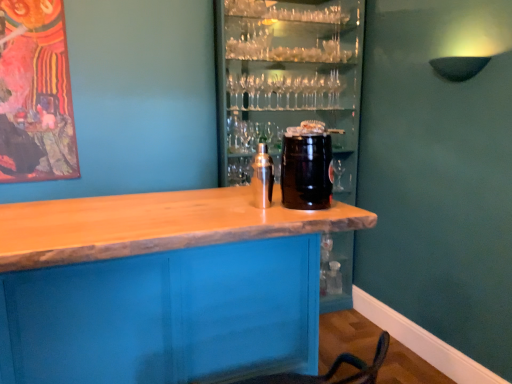
Question: Is wooden at center further to the viewer compared to satin silver shaker at center, which ranks as the 2th beverage in right-to-left order?

Choices:
 (A) no
 (B) yes

Answer: (B)

Question: Is wooden at center outside satin silver shaker at center, the first beverage in the left-to-right sequence?

Choices:
 (A) yes
 (B) no

Answer: (A)

Question: Does wooden at center have a greater height compared to satin silver shaker at center, which ranks as the 2th beverage in right-to-left order?

Choices:
 (A) yes
 (B) no

Answer: (A)

Question: Considering the relative positions of wooden at center and satin silver shaker at center, which ranks as the 2th beverage in right-to-left order, in the image provided, is wooden at center in front of satin silver shaker at center, which ranks as the 2th beverage in right-to-left order,?

Choices:
 (A) no
 (B) yes

Answer: (A)

Question: Does wooden at center have a greater width compared to satin silver shaker at center, the first beverage in the left-to-right sequence?

Choices:
 (A) no
 (B) yes

Answer: (B)

Question: Is satin silver shaker at center, which ranks as the 2th beverage in right-to-left order, taller or shorter than black matte keg at center, the first beverage from the right?

Choices:
 (A) tall
 (B) short

Answer: (B)

Question: Relative to black matte keg at center, the first beverage from the right, is satin silver shaker at center, the first beverage in the left-to-right sequence, in front or behind?

Choices:
 (A) behind
 (B) front

Answer: (A)

Question: Would you say satin silver shaker at center, the first beverage in the left-to-right sequence, is to the left or to the right of black matte keg at center, acting as the 2th beverage starting from the left, in the picture?

Choices:
 (A) right
 (B) left

Answer: (B)

Question: Is point coord(272,182) positioned closer to the camera than point coord(285,147)?

Choices:
 (A) farther
 (B) closer

Answer: (A)

Question: Considering the positions of wooden at center and black matte keg at center, the first beverage from the right, in the image, is wooden at center bigger or smaller than black matte keg at center, the first beverage from the right,?

Choices:
 (A) small
 (B) big

Answer: (B)

Question: In the image, is wooden at center positioned in front of or behind black matte keg at center, the first beverage from the right?

Choices:
 (A) behind
 (B) front

Answer: (A)

Question: From the image's perspective, is wooden at center above or below black matte keg at center, the first beverage from the right?

Choices:
 (A) above
 (B) below

Answer: (A)

Question: Is wooden at center inside the boundaries of black matte keg at center, the first beverage from the right, or outside?

Choices:
 (A) inside
 (B) outside

Answer: (B)

Question: Choose the correct answer: Is wooden table at center inside satin silver shaker at center, which ranks as the 2th beverage in right-to-left order, or outside it?

Choices:
 (A) inside
 (B) outside

Answer: (B)

Question: From a real-world perspective, relative to satin silver shaker at center, which ranks as the 2th beverage in right-to-left order, is wooden table at center vertically above or below?

Choices:
 (A) above
 (B) below

Answer: (B)